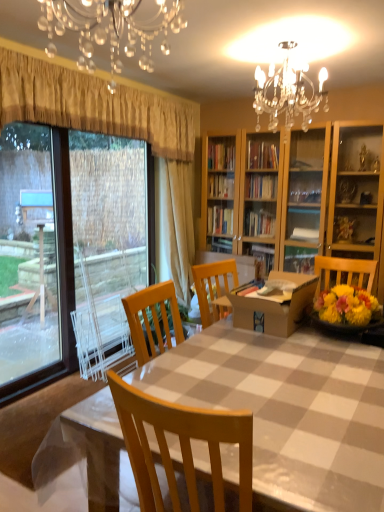
Question: Which direction should I rotate to look at beige fabric curtain at center, the 1th curtain when ordered from back to front, — up or down?

Choices:
 (A) down
 (B) up

Answer: (B)

Question: From a real-world perspective, is gold textured curtain at upper left, positioned as the 2th curtain in back-to-front order, positioned under checkered plastic table at center based on gravity?

Choices:
 (A) no
 (B) yes

Answer: (A)

Question: Is checkered plastic table at center located within gold textured curtain at upper left, positioned as the 2th curtain in back-to-front order?

Choices:
 (A) yes
 (B) no

Answer: (B)

Question: Is gold textured curtain at upper left, positioned as the 2th curtain in back-to-front order, at the left side of checkered plastic table at center?

Choices:
 (A) no
 (B) yes

Answer: (B)

Question: Considering the relative sizes of gold textured curtain at upper left, positioned as the 2th curtain in back-to-front order, and checkered plastic table at center in the image provided, is gold textured curtain at upper left, positioned as the 2th curtain in back-to-front order, taller than checkered plastic table at center?

Choices:
 (A) no
 (B) yes

Answer: (A)

Question: Is gold textured curtain at upper left, positioned as the 2th curtain in back-to-front order, not inside checkered plastic table at center?

Choices:
 (A) no
 (B) yes

Answer: (B)

Question: Can you confirm if gold textured curtain at upper left, positioned as the 2th curtain in back-to-front order, is positioned to the right of checkered plastic table at center?

Choices:
 (A) yes
 (B) no

Answer: (B)

Question: Can cardboard box at center be found inside checkered plastic table at center?

Choices:
 (A) no
 (B) yes

Answer: (A)

Question: Is the position of checkered plastic table at center less distant than that of cardboard box at center?

Choices:
 (A) no
 (B) yes

Answer: (B)

Question: Can you confirm if checkered plastic table at center is wider than cardboard box at center?

Choices:
 (A) no
 (B) yes

Answer: (B)

Question: Is checkered plastic table at center turned away from cardboard box at center?

Choices:
 (A) no
 (B) yes

Answer: (A)

Question: Is checkered plastic table at center next to cardboard box at center?

Choices:
 (A) no
 (B) yes

Answer: (A)

Question: Is checkered plastic table at center smaller than cardboard box at center?

Choices:
 (A) yes
 (B) no

Answer: (B)

Question: Is crystal glass chandelier at upper center closer to camera compared to checkered plastic table at center?

Choices:
 (A) yes
 (B) no

Answer: (A)